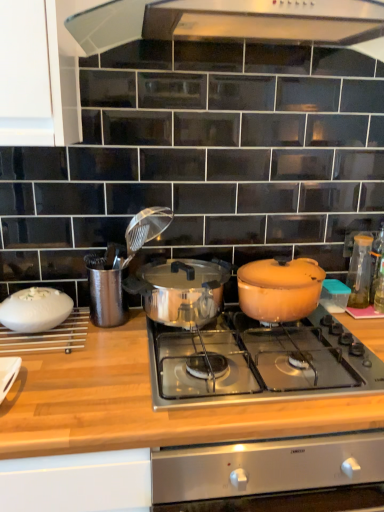
Question: Is there a large distance between polished stainless steel pot at center, arranged as the 2th pot/pan when viewed from the right, and transparent glass bottle at right, the 1th kitchen appliance positioned from the right?

Choices:
 (A) no
 (B) yes

Answer: (A)

Question: From the image's perspective, is polished stainless steel pot at center, arranged as the 2th pot/pan when viewed from the right, located above transparent glass bottle at right, which is the second kitchen appliance from front to back?

Choices:
 (A) no
 (B) yes

Answer: (A)

Question: From the image's perspective, is polished stainless steel pot at center, arranged as the 2th pot/pan when viewed from the right, beneath transparent glass bottle at right, which is the 1th kitchen appliance from back to front?

Choices:
 (A) yes
 (B) no

Answer: (A)

Question: Is polished stainless steel pot at center, which is the 1th pot/pan from left to right, oriented towards transparent glass bottle at right, which is the 1th kitchen appliance from back to front?

Choices:
 (A) yes
 (B) no

Answer: (B)

Question: Is polished stainless steel pot at center, arranged as the 2th pot/pan when viewed from the right, completely or partially outside of transparent glass bottle at right, which is the second kitchen appliance in left-to-right order?

Choices:
 (A) no
 (B) yes

Answer: (B)

Question: Considering the relative positions of polished stainless steel pot at center, which is the 1th pot/pan from left to right, and transparent glass bottle at right, which is the second kitchen appliance from front to back, in the image provided, is polished stainless steel pot at center, which is the 1th pot/pan from left to right, to the right of transparent glass bottle at right, which is the second kitchen appliance from front to back, from the viewer's perspective?

Choices:
 (A) no
 (B) yes

Answer: (A)

Question: Are transparent glass bottle at right and matte orange pot at center right, which is the 1th pot/pan from right to left, far apart?

Choices:
 (A) yes
 (B) no

Answer: (B)

Question: From a real-world perspective, is transparent glass bottle at right on matte orange pot at center right, which is the 1th pot/pan from right to left?

Choices:
 (A) no
 (B) yes

Answer: (B)

Question: Considering the relative sizes of transparent glass bottle at right and matte orange pot at center right, which is the 1th pot/pan from right to left, in the image provided, is transparent glass bottle at right wider than matte orange pot at center right, which is the 1th pot/pan from right to left,?

Choices:
 (A) yes
 (B) no

Answer: (B)

Question: Is transparent glass bottle at right closer to the viewer compared to matte orange pot at center right, which appears as the second pot/pan when viewed from the left?

Choices:
 (A) no
 (B) yes

Answer: (A)

Question: From the image's perspective, is transparent glass bottle at right beneath matte orange pot at center right, which appears as the second pot/pan when viewed from the left?

Choices:
 (A) no
 (B) yes

Answer: (A)

Question: Can you confirm if transparent glass bottle at right is bigger than matte orange pot at center right, which appears as the second pot/pan when viewed from the left?

Choices:
 (A) no
 (B) yes

Answer: (A)

Question: Is polished stainless steel pot at center, arranged as the 2th pot/pan when viewed from the right, bigger than shiny stainless steel cooktop at center?

Choices:
 (A) no
 (B) yes

Answer: (A)